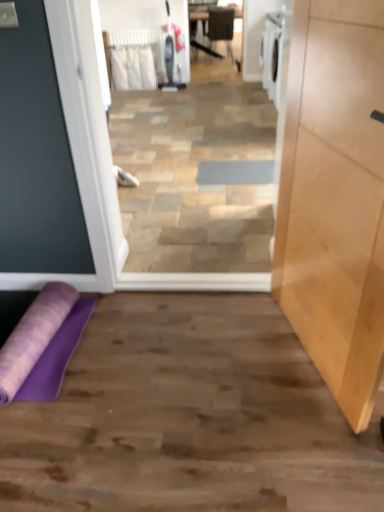
Question: Can you confirm if purple fabric yoga mat at lower left is shorter than gray fabric doormat at center?

Choices:
 (A) yes
 (B) no

Answer: (B)

Question: Is purple fabric yoga mat at lower left in front of gray fabric doormat at center?

Choices:
 (A) yes
 (B) no

Answer: (A)

Question: Can you confirm if purple fabric yoga mat at lower left is wider than gray fabric doormat at center?

Choices:
 (A) yes
 (B) no

Answer: (A)

Question: Considering the relative sizes of purple fabric yoga mat at lower left and gray fabric doormat at center in the image provided, is purple fabric yoga mat at lower left smaller than gray fabric doormat at center?

Choices:
 (A) no
 (B) yes

Answer: (A)

Question: Is purple fabric yoga mat at lower left bigger than gray fabric doormat at center?

Choices:
 (A) yes
 (B) no

Answer: (A)

Question: Is point (226, 182) positioned closer to the camera than point (370, 410)?

Choices:
 (A) farther
 (B) closer

Answer: (A)

Question: Is gray fabric doormat at center situated inside light wood cabinet at right or outside?

Choices:
 (A) inside
 (B) outside

Answer: (B)

Question: Based on their sizes in the image, would you say gray fabric doormat at center is bigger or smaller than light wood cabinet at right?

Choices:
 (A) small
 (B) big

Answer: (A)

Question: Looking at their shapes, would you say gray fabric doormat at center is wider or thinner than light wood cabinet at right?

Choices:
 (A) wide
 (B) thin

Answer: (A)

Question: Based on their positions, is purple fabric yoga mat at lower left located to the left or right of gray fabric doormat at center?

Choices:
 (A) right
 (B) left

Answer: (B)

Question: Is purple fabric yoga mat at lower left wider or thinner than gray fabric doormat at center?

Choices:
 (A) thin
 (B) wide

Answer: (B)

Question: From their relative heights in the image, would you say purple fabric yoga mat at lower left is taller or shorter than gray fabric doormat at center?

Choices:
 (A) tall
 (B) short

Answer: (A)

Question: Considering their positions, is purple fabric yoga mat at lower left located in front of or behind gray fabric doormat at center?

Choices:
 (A) behind
 (B) front

Answer: (B)

Question: Is purple fabric yoga mat at lower left to the left or to the right of matte black chair at center in the image?

Choices:
 (A) left
 (B) right

Answer: (A)

Question: Does point (36, 353) appear closer or farther from the camera than point (226, 8)?

Choices:
 (A) closer
 (B) farther

Answer: (A)